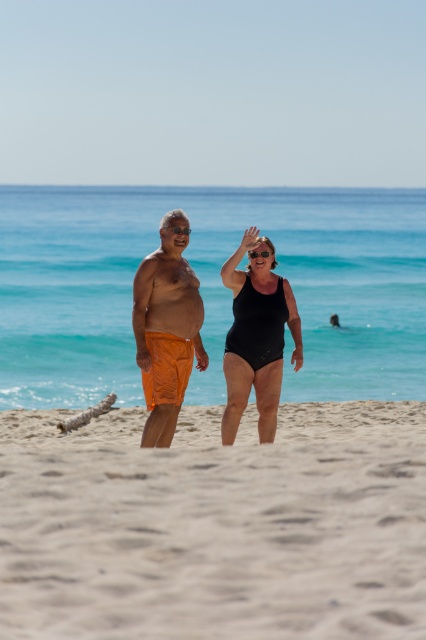
You are standing at the point marked by the coordinates point [215,525]. Looking towards the ocean, which direction should you walk to reach the woman in the black one piece swimsuit on the right?

The smooth sand at center is represented by point [215,525]. Since the woman in the black one piece swimsuit on the right is positioned to the right of the center, you should walk towards the right direction from the point [215,525] to reach her.

You are a beachgoer who wants to buy a pair of goggles. You see two options available at the vendor stand in the scene, the transparent plastic goggles at center and the clear plastic goggles at center. Which pair has a wider width?

The transparent plastic goggles at center has a larger width than the clear plastic goggles at center according to the description.